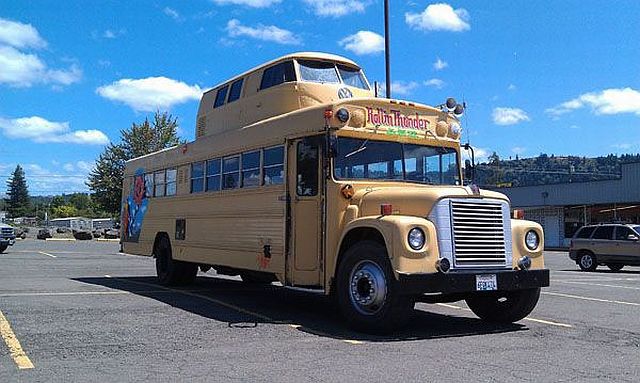
Locate an element on the screen. door is located at coordinates [x=307, y=234], [x=598, y=247], [x=624, y=251], [x=550, y=228].